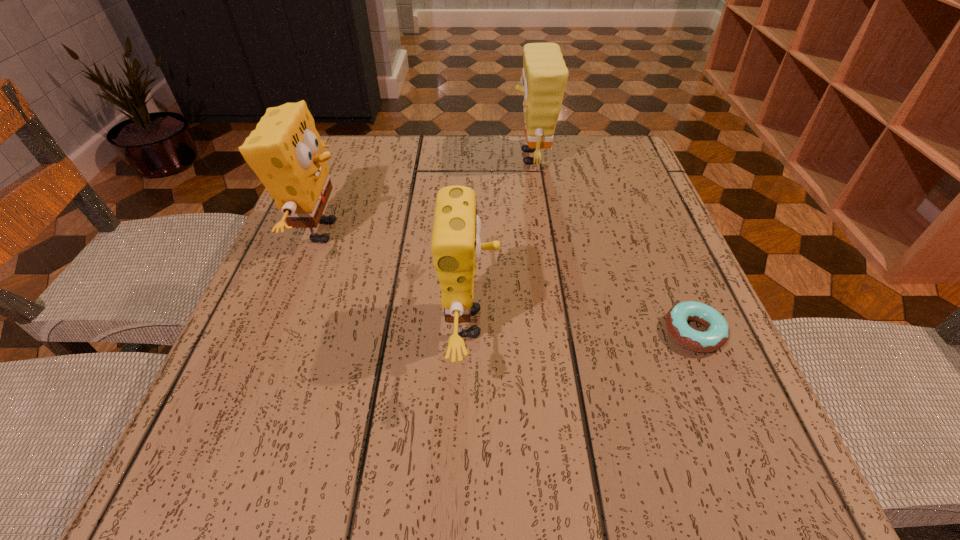
You are a GUI agent. You are given a task and a screenshot of the screen. Output one action in this format:
    pyautogui.click(x=<x>, y=<y>)
    Task: Click on the object that can be found as the third closest to the leftmost sponge
    
    Given the screenshot: What is the action you would take?
    pyautogui.click(x=716, y=335)

This screenshot has width=960, height=540. Find the location of `object that is the closest to the shortest object`. object that is the closest to the shortest object is located at coordinates (456, 246).

Identify which sponge is the second nearest to the leftmost object. Please provide its 2D coordinates. Your answer should be formatted as a tuple, i.e. [(x, y)], where the tuple contains the x and y coordinates of a point satisfying the conditions above.

[(544, 76)]

Locate which sponge is the third closest to the doughnut. Please provide its 2D coordinates. Your answer should be formatted as a tuple, i.e. [(x, y)], where the tuple contains the x and y coordinates of a point satisfying the conditions above.

[(285, 152)]

Where is `free space that satisfies the following two spatial constraints: 1. on the face of the doughnut; 2. on the left side of the third object from right to left`? free space that satisfies the following two spatial constraints: 1. on the face of the doughnut; 2. on the left side of the third object from right to left is located at coordinates (470, 332).

The height and width of the screenshot is (540, 960). What are the coordinates of `free space that satisfies the following two spatial constraints: 1. on the back side of the shortest object; 2. on the face of the leftmost object` in the screenshot? It's located at (651, 231).

Where is `vacant point that satisfies the following two spatial constraints: 1. on the face of the second sponge from left to right; 2. on the left side of the doughnut`? This screenshot has height=540, width=960. vacant point that satisfies the following two spatial constraints: 1. on the face of the second sponge from left to right; 2. on the left side of the doughnut is located at coordinates (470, 332).

The image size is (960, 540). Identify the location of free location that satisfies the following two spatial constraints: 1. on the face of the shortest object; 2. on the left side of the second object from left to right. (470, 332).

You are a GUI agent. You are given a task and a screenshot of the screen. Output one action in this format:
    pyautogui.click(x=<x>, y=<y>)
    Task: Click on the free space that satisfies the following two spatial constraints: 1. on the back side of the shortest object; 2. on the face of the leftmost object
    Image resolution: width=960 pixels, height=540 pixels.
    Given the screenshot: What is the action you would take?
    pyautogui.click(x=651, y=231)

What are the coordinates of `free space that satisfies the following two spatial constraints: 1. on the face of the third object from right to left; 2. on the back side of the rightmost object` in the screenshot? It's located at (470, 332).